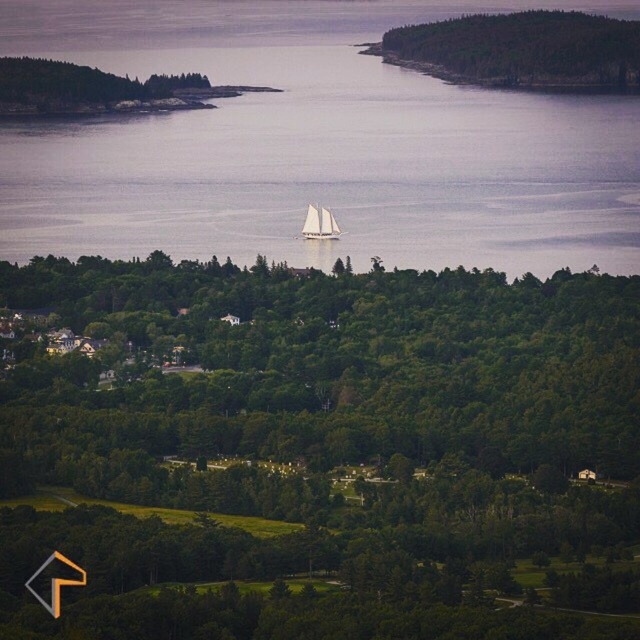
Does clear water at center have a smaller size compared to white sailboat at center?

No, clear water at center is not smaller than white sailboat at center.

Is clear water at center further to camera compared to white sailboat at center?

No, it is not.

Is point (337, 182) more distant than point (305, 237)?

Yes, point (337, 182) is farther from viewer.

At what (x,y) coordinates should I click in order to perform the action: click on clear water at center. Please return your answer as a coordinate pair (x, y). This screenshot has height=640, width=640. Looking at the image, I should click on (314, 145).

Who is shorter, green leafy tree at center or clear water at center?

With less height is clear water at center.

Is green leafy tree at center taller than clear water at center?

Indeed, green leafy tree at center has a greater height compared to clear water at center.

Is point (186, 506) closer to camera compared to point (628, 1)?

Yes, point (186, 506) is closer to viewer.

Find the location of a particular element. The width and height of the screenshot is (640, 640). green leafy tree at center is located at coordinates (323, 451).

Can you confirm if green leafy tree at center is positioned above white sailboat at center?

Actually, green leafy tree at center is below white sailboat at center.

Does green leafy tree at center have a smaller size compared to white sailboat at center?

No.

Between point (141, 381) and point (310, 234), which one is positioned behind?

Positioned behind is point (141, 381).

Find the location of a particular element. The width and height of the screenshot is (640, 640). green leafy tree at center is located at coordinates (323, 451).